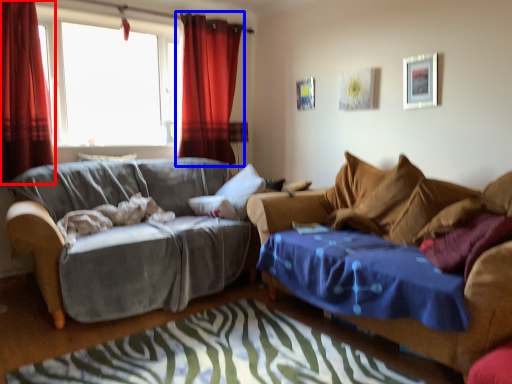
Question: Which object is further to the camera taking this photo, curtain (highlighted by a red box) or curtain (highlighted by a blue box)?

Choices:
 (A) curtain
 (B) curtain

Answer: (B)